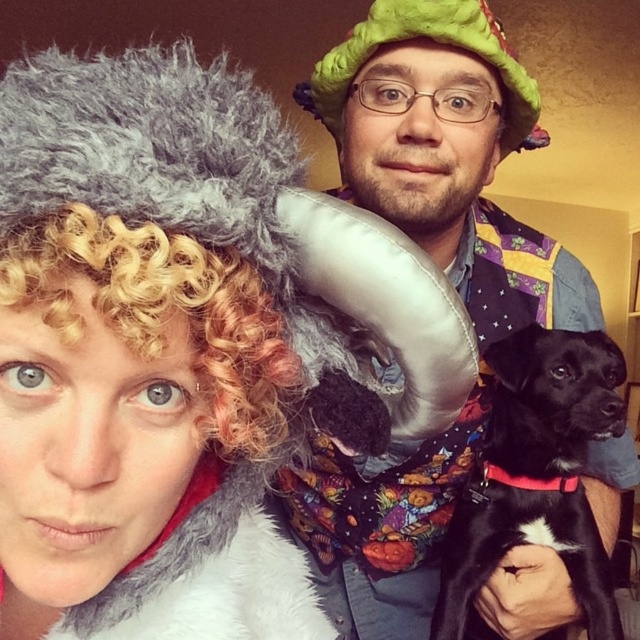
Does fluffy gray wig at upper left have a greater height compared to curly blonde wig at upper left?

Indeed, fluffy gray wig at upper left has a greater height compared to curly blonde wig at upper left.

Based on the photo, between fluffy gray wig at upper left and curly blonde wig at upper left, which one is positioned lower?

fluffy gray wig at upper left

Does point (436, 10) come in front of point (49, 310)?

No, (436, 10) is behind (49, 310).

Locate an element on the screen. The width and height of the screenshot is (640, 640). fluffy gray wig at upper left is located at coordinates (448, 156).

How far apart are fluffy gray wig at upper left and black smooth dog at center?

fluffy gray wig at upper left and black smooth dog at center are 4.27 inches apart from each other.

The height and width of the screenshot is (640, 640). What do you see at coordinates (448, 156) in the screenshot?
I see `fluffy gray wig at upper left` at bounding box center [448, 156].

Locate an element on the screen. This screenshot has width=640, height=640. fluffy gray wig at upper left is located at coordinates (448, 156).

Which is behind, point (196, 296) or point (488, 424)?

The point (488, 424) is more distant.

Is curly blonde wig at upper left taller than black smooth dog at center?

In fact, curly blonde wig at upper left may be shorter than black smooth dog at center.

Which is behind, point (300, 362) or point (586, 388)?

Point (586, 388)

Identify the location of curly blonde wig at upper left. (164, 312).